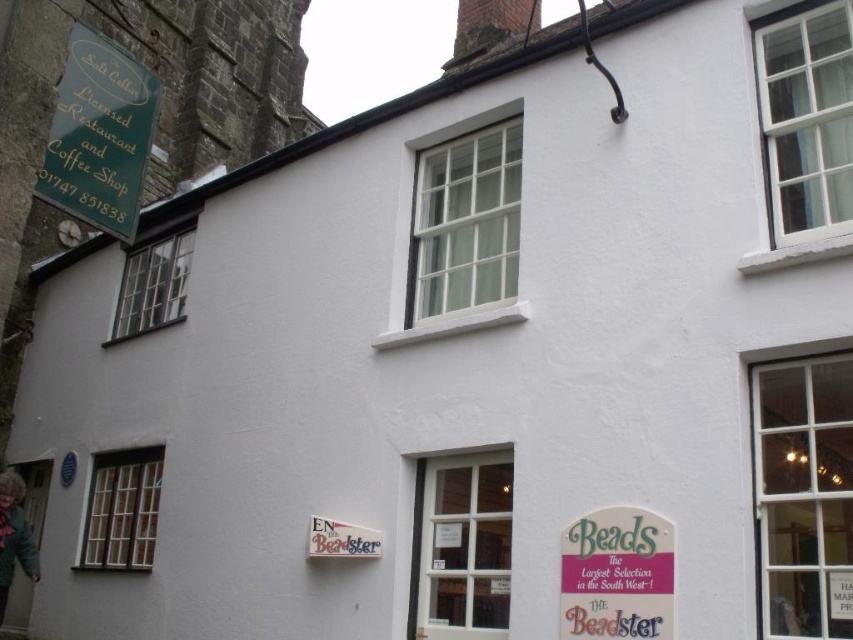
Between green painted wood signboard at upper left and white matte sign at center, which one has more height?

green painted wood signboard at upper left is taller.

Does point (100, 118) lie in front of point (309, 545)?

No, it is behind (309, 545).

You are a GUI agent. You are given a task and a screenshot of the screen. Output one action in this format:
    pyautogui.click(x=<x>, y=<y>)
    Task: Click on the green painted wood signboard at upper left
    Image resolution: width=853 pixels, height=640 pixels.
    Given the screenshot: What is the action you would take?
    pyautogui.click(x=99, y=134)

Does green painted wood signboard at upper left lie in front of green paper sign at center?

That is False.

Does green painted wood signboard at upper left appear on the left side of green paper sign at center?

Yes, green painted wood signboard at upper left is to the left of green paper sign at center.

Describe the element at coordinates (99, 134) in the screenshot. The width and height of the screenshot is (853, 640). I see `green painted wood signboard at upper left` at that location.

Find the location of a particular element. This screenshot has width=853, height=640. green painted wood signboard at upper left is located at coordinates (99, 134).

Is point (653, 570) farther from viewer compared to point (317, 522)?

No, (653, 570) is in front of (317, 522).

Based on the photo, can you confirm if green paper sign at center is thinner than white matte sign at center?

In fact, green paper sign at center might be wider than white matte sign at center.

Is point (611, 589) positioned before point (375, 552)?

Yes, point (611, 589) is closer to viewer.

The width and height of the screenshot is (853, 640). Find the location of `green paper sign at center`. green paper sign at center is located at coordinates (618, 577).